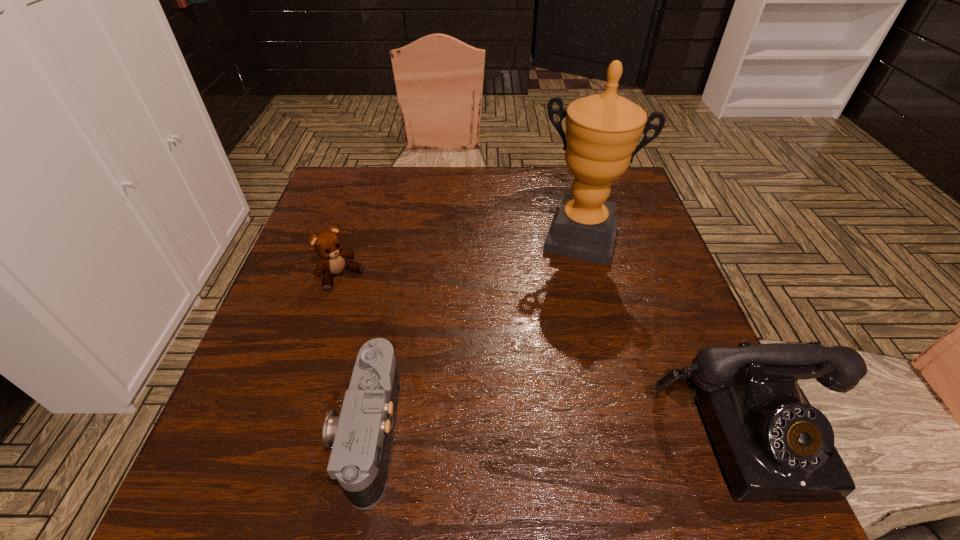
This screenshot has height=540, width=960. What are the coordinates of `vacant space that's between the award and the camera` in the screenshot? It's located at (474, 335).

Identify the location of object identified as the closest to the leftmost object. (361, 438).

Locate which object ranks second in proximity to the camera. Please provide its 2D coordinates. Your answer should be formatted as a tuple, i.e. [(x, y)], where the tuple contains the x and y coordinates of a point satisfying the conditions above.

[(602, 131)]

The image size is (960, 540). I want to click on free spot that satisfies the following two spatial constraints: 1. on the front side of the camera; 2. on the lens of the teddy bear, so [292, 432].

This screenshot has height=540, width=960. What are the coordinates of `vacant space that satisfies the following two spatial constraints: 1. on the front side of the camera; 2. on the lens of the teddy bear` in the screenshot? It's located at (292, 432).

Image resolution: width=960 pixels, height=540 pixels. In order to click on vacant area that satisfies the following two spatial constraints: 1. on the back side of the tallest object; 2. on the left side of the teddy bear in this screenshot , I will do `click(352, 239)`.